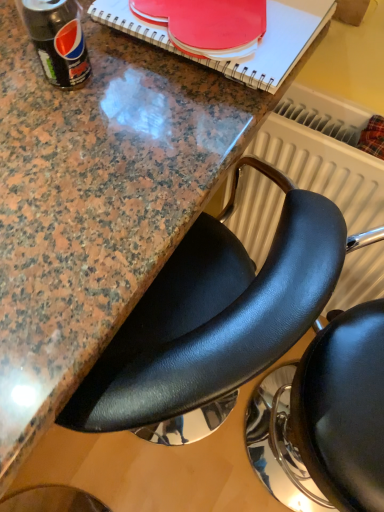
Measure the distance between point (202,377) and camera.

17.72 inches.

The width and height of the screenshot is (384, 512). What do you see at coordinates (216, 314) in the screenshot?
I see `black leather chair at lower right` at bounding box center [216, 314].

Image resolution: width=384 pixels, height=512 pixels. Identify the location of black leather chair at lower right. pos(216,314).

Locate an element on the screen. Image resolution: width=384 pixels, height=512 pixels. black leather chair at lower right is located at coordinates (216, 314).